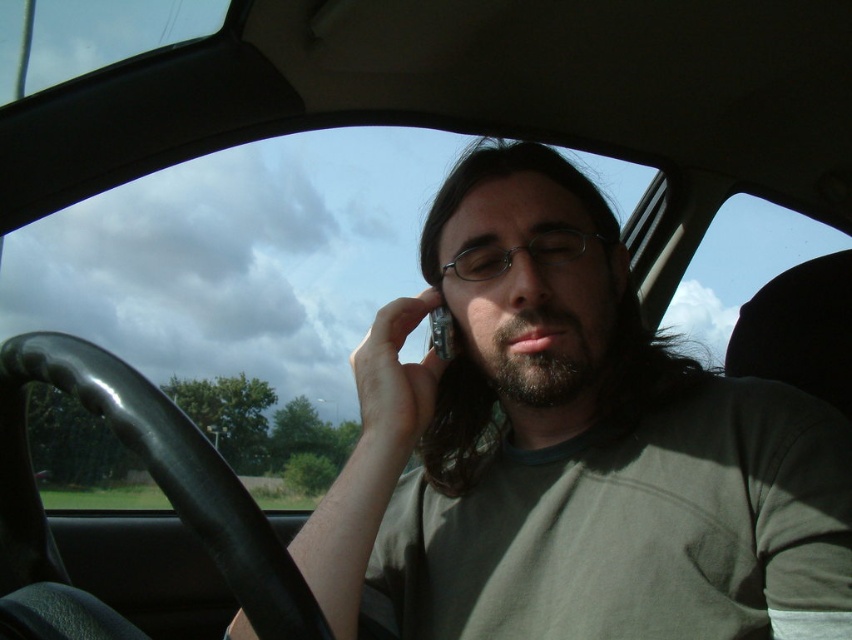
Question: Which object is closer to the camera taking this photo?

Choices:
 (A) matte black phone at center
 (B) transparent glass car window at upper center

Answer: (A)

Question: Considering the relative positions of transparent glass car window at upper center and matte black phone at center in the image provided, where is transparent glass car window at upper center located with respect to matte black phone at center?

Choices:
 (A) right
 (B) left

Answer: (B)

Question: Among these objects, which one is farthest from the camera?

Choices:
 (A) matte black phone at center
 (B) transparent glass car window at upper center

Answer: (B)

Question: From the image, what is the correct spatial relationship of transparent glass car window at upper center in relation to matte black phone at center?

Choices:
 (A) above
 (B) below

Answer: (B)

Question: Does transparent glass car window at upper center appear on the right side of matte black phone at center?

Choices:
 (A) no
 (B) yes

Answer: (A)